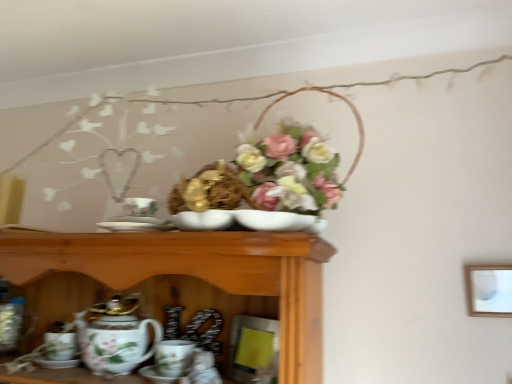
Question: Is matte white picture frame at upper right placed right next to porcelain plate at center?

Choices:
 (A) no
 (B) yes

Answer: (A)

Question: From a real-world perspective, is matte white picture frame at upper right beneath porcelain plate at center?

Choices:
 (A) yes
 (B) no

Answer: (A)

Question: From a real-world perspective, is matte white picture frame at upper right on top of porcelain plate at center?

Choices:
 (A) no
 (B) yes

Answer: (A)

Question: Is matte white picture frame at upper right smaller than porcelain plate at center?

Choices:
 (A) no
 (B) yes

Answer: (A)

Question: From the image's perspective, is matte white picture frame at upper right on top of porcelain plate at center?

Choices:
 (A) yes
 (B) no

Answer: (B)

Question: Is matte white picture frame at upper right turned away from porcelain plate at center?

Choices:
 (A) yes
 (B) no

Answer: (B)

Question: Is porcelain floral teapot at lower left next to porcelain coffee cup at lower center and touching it?

Choices:
 (A) no
 (B) yes

Answer: (B)

Question: Is porcelain floral teapot at lower left not near porcelain coffee cup at lower center?

Choices:
 (A) no
 (B) yes

Answer: (A)

Question: Could you tell me if porcelain floral teapot at lower left is facing porcelain coffee cup at lower center?

Choices:
 (A) yes
 (B) no

Answer: (B)

Question: Can you confirm if porcelain floral teapot at lower left is shorter than porcelain coffee cup at lower center?

Choices:
 (A) yes
 (B) no

Answer: (B)

Question: Is porcelain floral teapot at lower left wider than porcelain coffee cup at lower center?

Choices:
 (A) yes
 (B) no

Answer: (A)

Question: Is porcelain floral teapot at lower left bigger than porcelain coffee cup at lower center?

Choices:
 (A) no
 (B) yes

Answer: (B)

Question: Is porcelain coffee cup at lower center bigger than matte white picture frame at upper right?

Choices:
 (A) no
 (B) yes

Answer: (B)